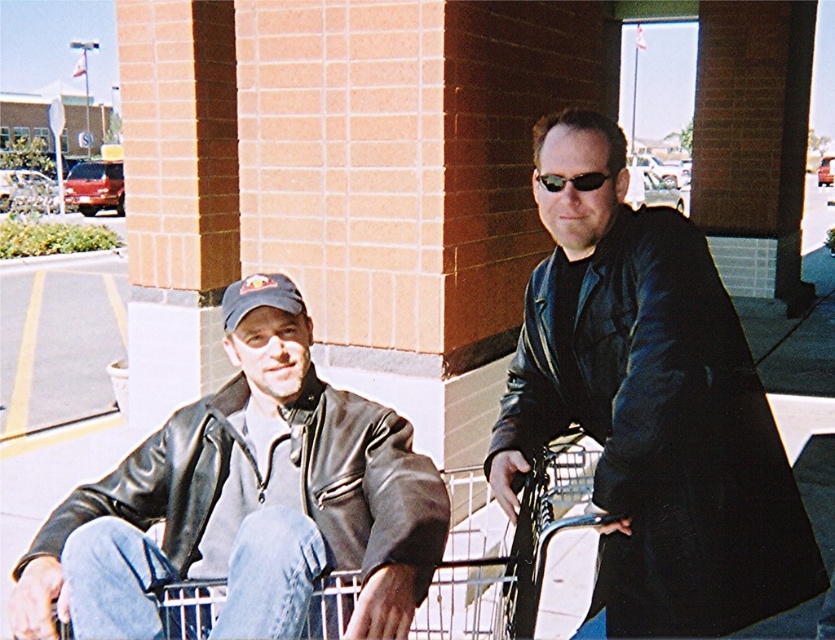
Between point (505, 468) and point (428, 499), which one is positioned behind?

The point (505, 468) is behind.

Looking at this image, who is positioned more to the left, matte black jacket at center or matte black jacket at left?

From the viewer's perspective, matte black jacket at left appears more on the left side.

This screenshot has width=835, height=640. I want to click on matte black jacket at center, so click(650, 406).

Does matte black jacket at center appear on the left side of metallic silver shopping cart at lower center?

No, matte black jacket at center is not to the left of metallic silver shopping cart at lower center.

Can you confirm if matte black jacket at center is positioned below metallic silver shopping cart at lower center?

No, matte black jacket at center is not below metallic silver shopping cart at lower center.

Who is more forward, (567,195) or (489,524)?

Positioned in front is point (567,195).

At what (x,y) coordinates should I click in order to perform the action: click on matte black jacket at center. Please return your answer as a coordinate pair (x, y). This screenshot has height=640, width=835. Looking at the image, I should click on (650, 406).

From the picture: Can you confirm if metallic silver shopping cart at lower center is positioned below black plastic sunglasses at upper center?

Indeed, metallic silver shopping cart at lower center is positioned under black plastic sunglasses at upper center.

Who is more forward, (578, 477) or (547, 180)?

Point (547, 180) is more forward.

Who is more forward, (x=492, y=612) or (x=552, y=179)?

Point (x=552, y=179) is in front.

I want to click on metallic silver shopping cart at lower center, so click(505, 545).